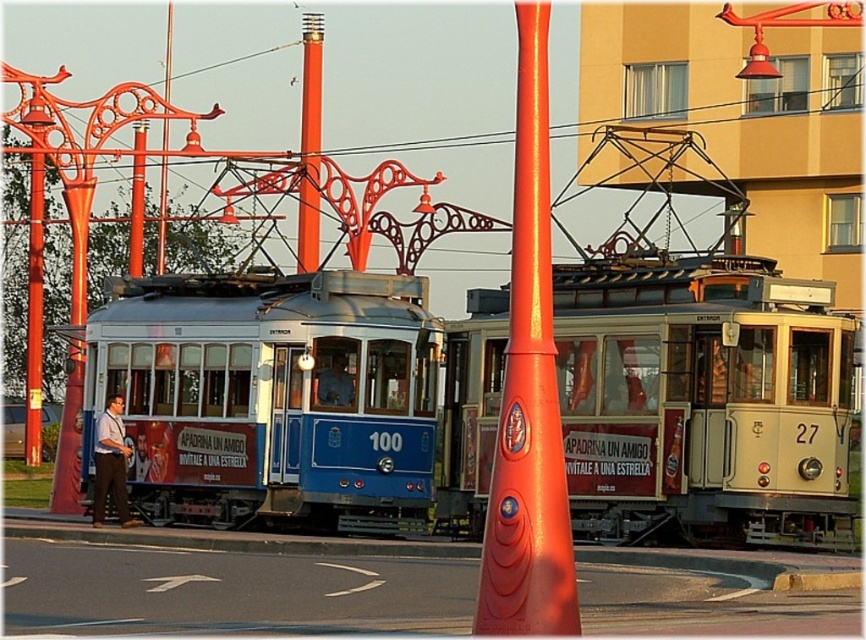
Can you confirm if blue polished metal tram at center is wider than metallic red pole at center?

In fact, blue polished metal tram at center might be narrower than metallic red pole at center.

Is point (385, 484) less distant than point (160, 216)?

Yes, point (385, 484) is closer to viewer.

The image size is (866, 640). Find the location of `blue polished metal tram at center`. blue polished metal tram at center is located at coordinates (270, 397).

Is matte cream cable car at center to the right of metallic pole at center from the viewer's perspective?

Correct, you'll find matte cream cable car at center to the right of metallic pole at center.

The width and height of the screenshot is (866, 640). Find the location of `matte cream cable car at center`. matte cream cable car at center is located at coordinates (703, 403).

Measure the distance from matte cream cable car at center to smooth orange pole at center.

They are 44.27 meters apart.

Locate an element on the screen. matte cream cable car at center is located at coordinates (703, 403).

Locate an element on the screen. This screenshot has height=640, width=866. matte cream cable car at center is located at coordinates (703, 403).